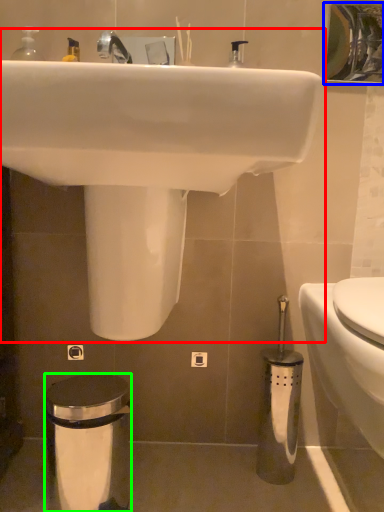
Question: Considering the real-world distances, which object is farthest from sink (highlighted by a red box)? mirror (highlighted by a blue box) or trash bin/can (highlighted by a green box)?

Choices:
 (A) mirror
 (B) trash bin/can

Answer: (A)